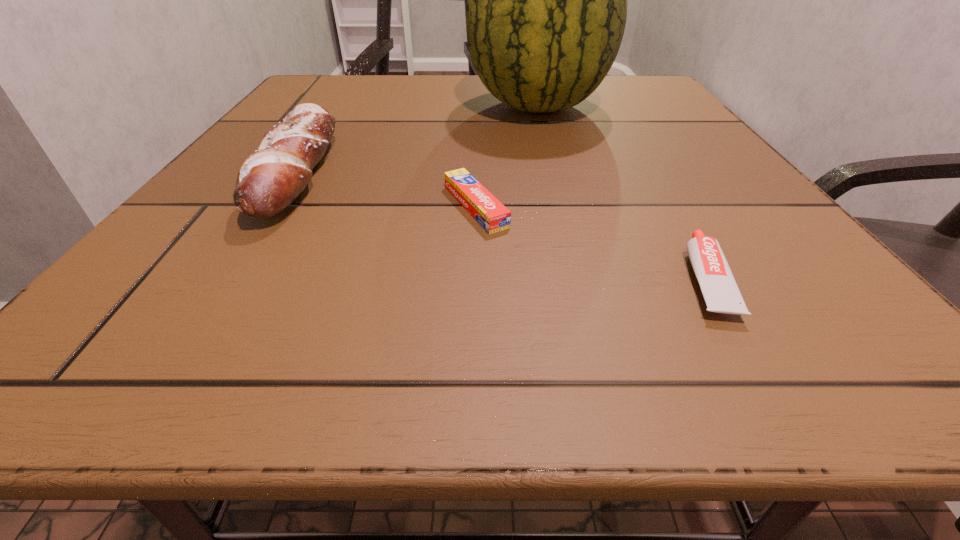
Identify the location of blank region between the nearer toothpaste and the left toothpaste. (590, 243).

At what (x,y) coordinates should I click in order to perform the action: click on vacant space that is in between the tallest object and the shortest object. Please return your answer as a coordinate pair (x, y). The width and height of the screenshot is (960, 540). Looking at the image, I should click on (507, 157).

Image resolution: width=960 pixels, height=540 pixels. I want to click on empty space that is in between the shorter toothpaste and the leftmost object, so click(x=387, y=189).

The width and height of the screenshot is (960, 540). I want to click on vacant area that lies between the farther toothpaste and the nearer toothpaste, so click(x=590, y=243).

The image size is (960, 540). Find the location of `object that is the second closest to the left toothpaste`. object that is the second closest to the left toothpaste is located at coordinates (269, 180).

Point out which object is positioned as the third nearest to the shorter toothpaste. Please provide its 2D coordinates. Your answer should be formatted as a tuple, i.e. [(x, y)], where the tuple contains the x and y coordinates of a point satisfying the conditions above.

[(720, 291)]

I want to click on vacant space that satisfies the following two spatial constraints: 1. on the front side of the right toothpaste; 2. on the left side of the leftmost object, so click(x=228, y=279).